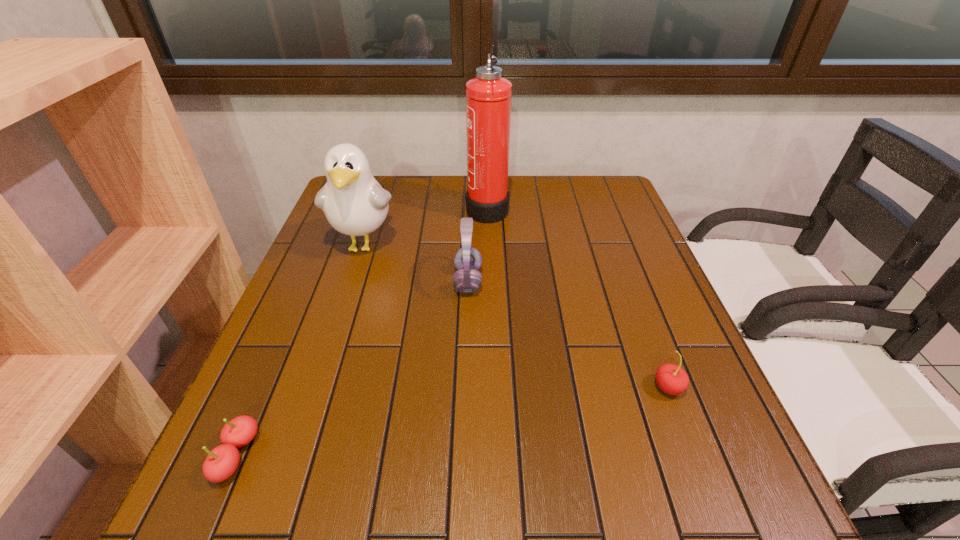
The height and width of the screenshot is (540, 960). In order to click on free space located 0.150m on the beak of the gull in this screenshot , I will do `click(341, 315)`.

What are the coordinates of `vacant region located on the headband and ear cups of the headset` in the screenshot? It's located at (632, 281).

You are a GUI agent. You are given a task and a screenshot of the screen. Output one action in this format:
    pyautogui.click(x=<x>, y=<y>)
    Task: Click on the vacant space situated on the back of the farther cherry
    The height and width of the screenshot is (540, 960).
    Given the screenshot: What is the action you would take?
    pyautogui.click(x=636, y=304)

At what (x,y) coordinates should I click in order to perform the action: click on vacant space situated 0.190m on the right of the left cherry. Please return your answer as a coordinate pair (x, y). Looking at the image, I should click on (366, 456).

Where is `object located at the far edge`? object located at the far edge is located at coordinates (488, 96).

Find the location of a particular element. The width and height of the screenshot is (960, 540). object that is at the near edge is located at coordinates (221, 463).

Locate an element on the screen. The width and height of the screenshot is (960, 540). gull at the left edge is located at coordinates (355, 204).

At what (x,y) coordinates should I click in order to perform the action: click on cherry present at the left edge. Please return your answer as a coordinate pair (x, y). Looking at the image, I should click on (221, 463).

Find the location of `object that is at the right edge`. object that is at the right edge is located at coordinates (672, 379).

This screenshot has width=960, height=540. I want to click on object positioned at the near left corner, so (x=221, y=463).